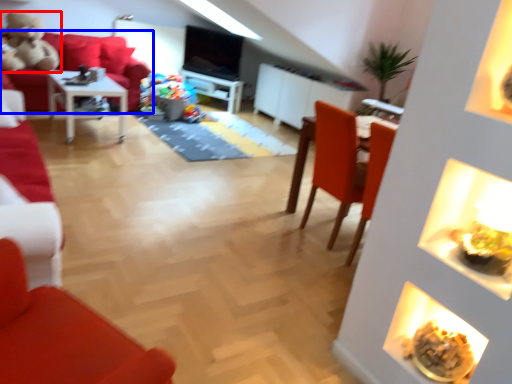
Question: Which object is closer to the camera taking this photo, toy (highlighted by a red box) or studio couch (highlighted by a blue box)?

Choices:
 (A) toy
 (B) studio couch

Answer: (A)